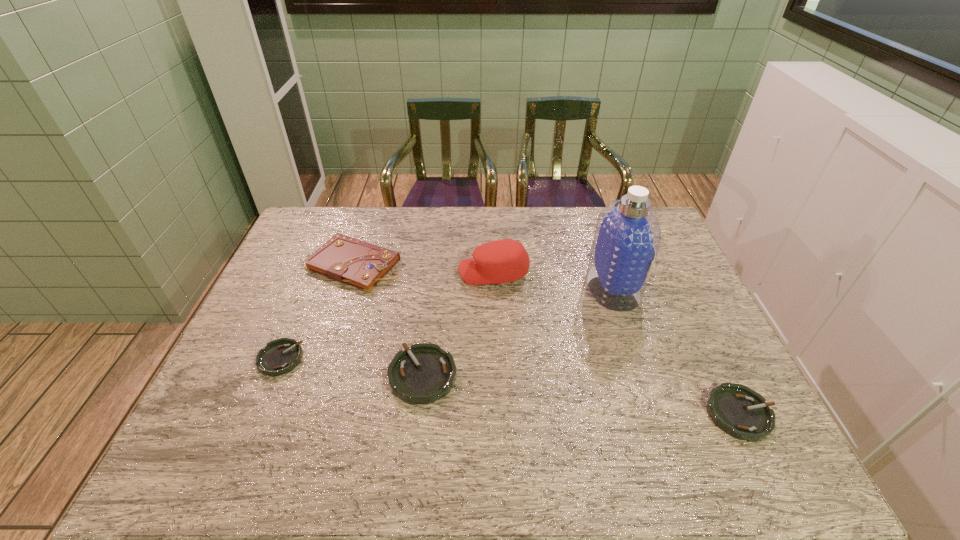
What are the coordinates of `the shortest object` in the screenshot? It's located at (280, 356).

The width and height of the screenshot is (960, 540). What are the coordinates of `the shortest ashtray` in the screenshot? It's located at (280, 356).

The width and height of the screenshot is (960, 540). What are the coordinates of `the tallest ashtray` in the screenshot? It's located at (421, 375).

Identify the location of the second ashtray from left to right. (421, 375).

Find the location of a particular element. the rightmost object is located at coordinates (736, 409).

Where is `the fifth tallest object`? the fifth tallest object is located at coordinates (736, 409).

Identify the location of the tallest object. This screenshot has height=540, width=960. (627, 236).

Locate an element on the screen. The image size is (960, 540). the fifth object from left to right is located at coordinates (627, 236).

Where is `cap`? Image resolution: width=960 pixels, height=540 pixels. cap is located at coordinates (502, 261).

Where is `notebook`? This screenshot has height=540, width=960. notebook is located at coordinates [x=347, y=260].